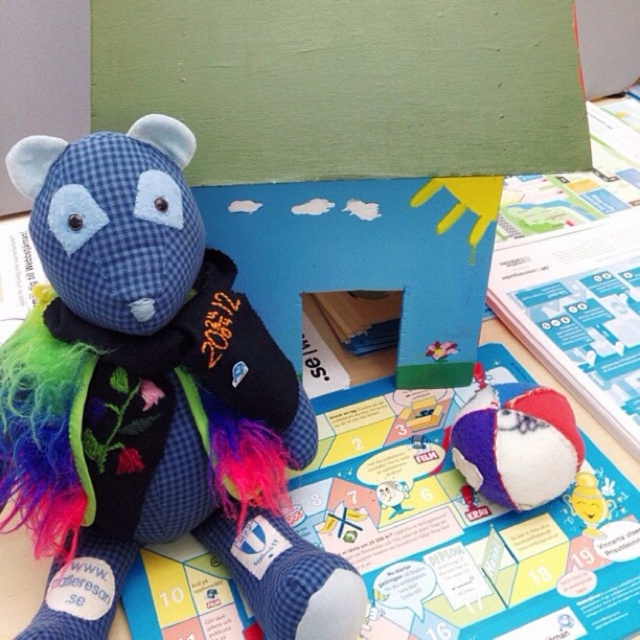
Is point (109, 579) in front of point (476, 420)?

Yes, it is in front of point (476, 420).

Does blue checkered fabric teddy bear at center have a greater width compared to textured fabric ball at lower right?

Yes, blue checkered fabric teddy bear at center is wider than textured fabric ball at lower right.

Locate an element on the screen. The image size is (640, 640). blue checkered fabric teddy bear at center is located at coordinates (150, 396).